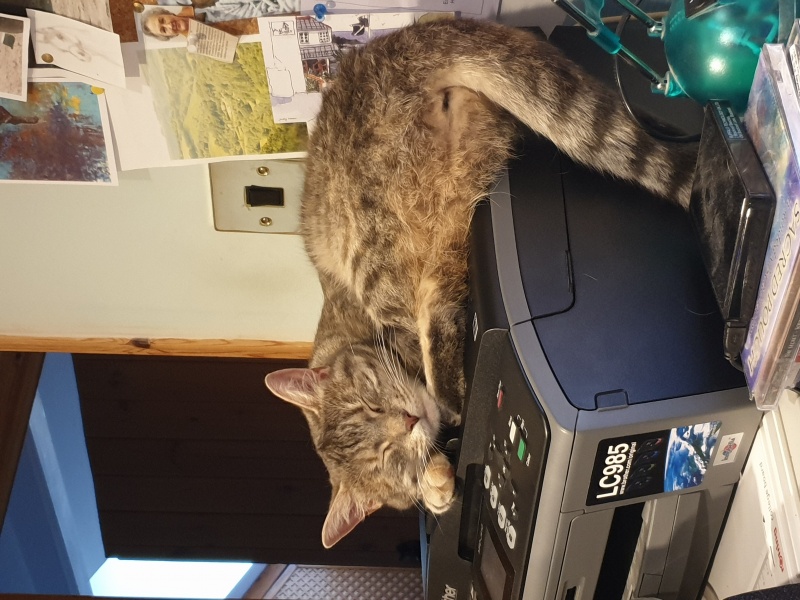
Locate an element on the screen. blue ceiling is located at coordinates (56, 472).